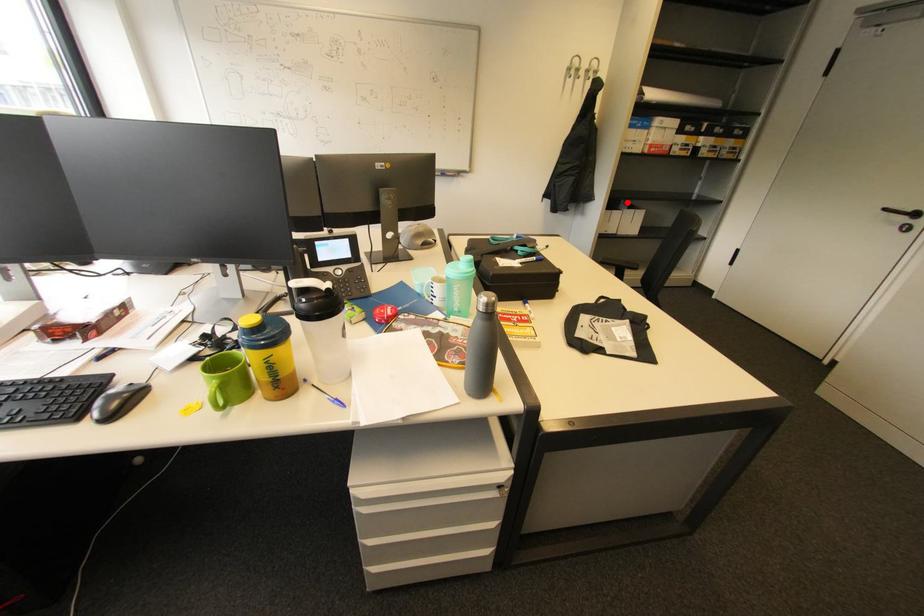
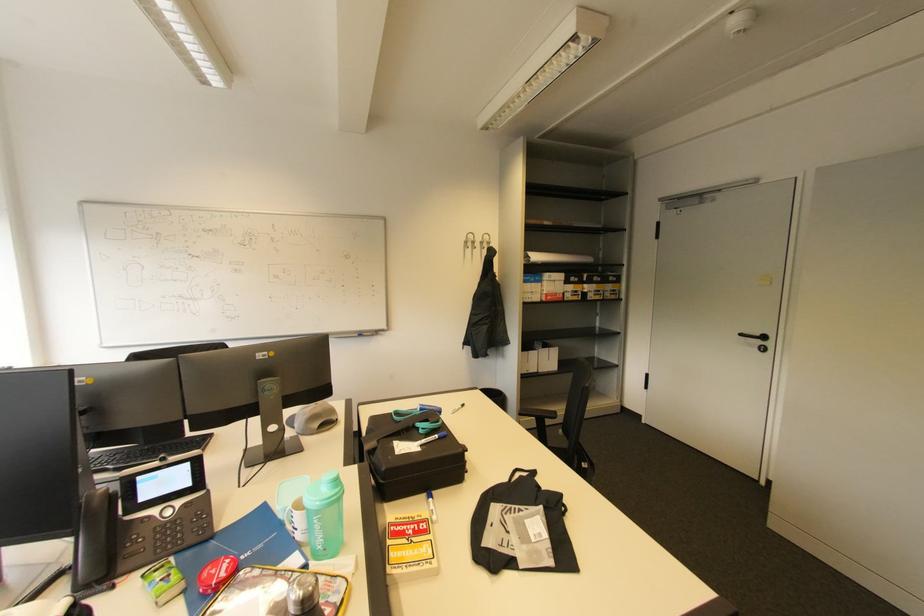
The point at the highlighted location is marked in the first image. Where is the corresponding point in the second image?

(541, 342)